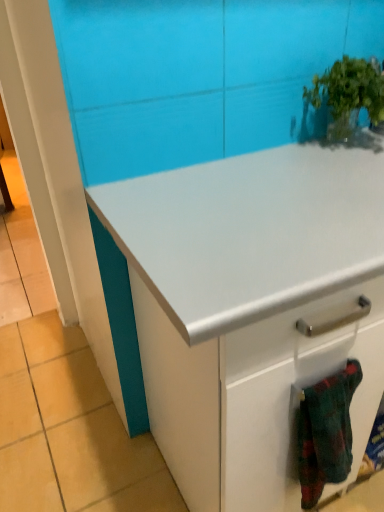
Find the location of a particular element. The height and width of the screenshot is (512, 384). space that is in front of green leafy plant at upper right is located at coordinates [339, 186].